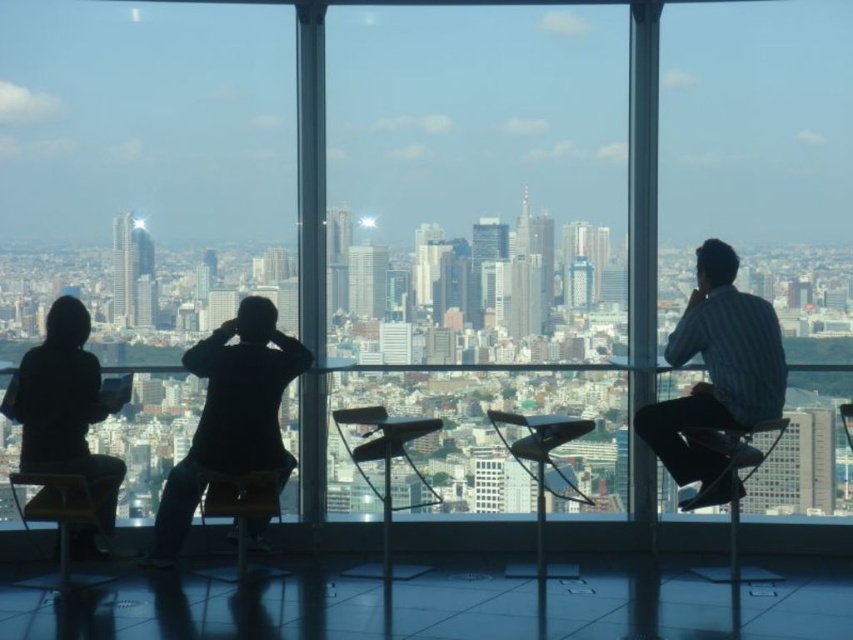
This screenshot has height=640, width=853. Describe the element at coordinates (67, 413) in the screenshot. I see `silhouette jacket at left` at that location.

Between silhouette jacket at left and metallic silver chair at center, which one has more height?

With more height is silhouette jacket at left.

Image resolution: width=853 pixels, height=640 pixels. In order to click on silhouette jacket at left in this screenshot , I will do `click(67, 413)`.

Does point (16, 499) come behind point (392, 577)?

Yes, point (16, 499) is farther from viewer.

Is wooden chair at lower left further to the viewer compared to metallic silver chair at center?

Yes, wooden chair at lower left is behind metallic silver chair at center.

This screenshot has width=853, height=640. What do you see at coordinates (64, 516) in the screenshot? I see `wooden chair at lower left` at bounding box center [64, 516].

Locate an element on the screen. The height and width of the screenshot is (640, 853). wooden chair at lower left is located at coordinates (64, 516).

Can you confirm if black matte jacket at center is smaller than wooden chair at lower left?

No, black matte jacket at center is not smaller than wooden chair at lower left.

Between black matte jacket at center and wooden chair at lower left, which one appears on the left side from the viewer's perspective?

wooden chair at lower left is more to the left.

Find the location of `black matte jacket at center`. black matte jacket at center is located at coordinates (231, 416).

This screenshot has width=853, height=640. I want to click on black matte jacket at center, so click(x=231, y=416).